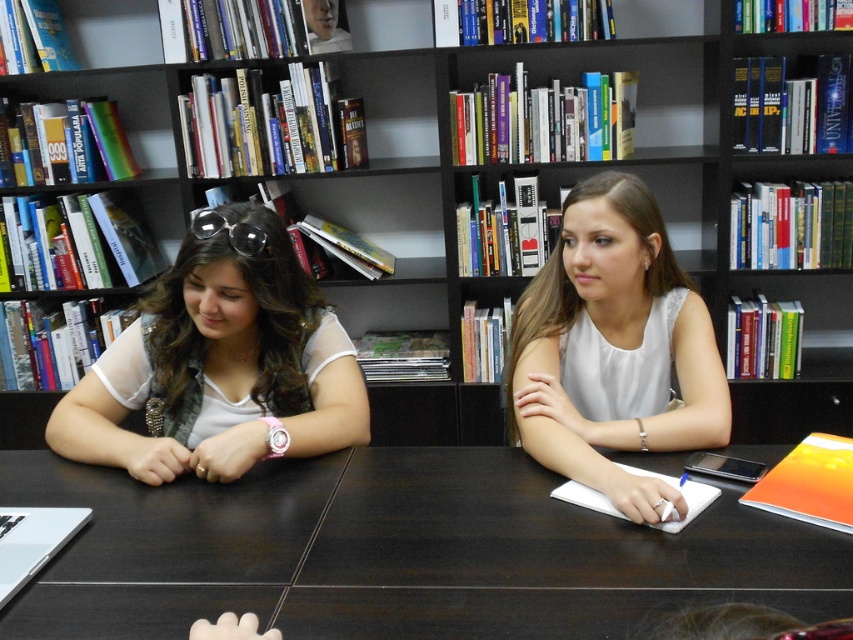
Is point (144, 342) less distant than point (679, 340)?

No, (144, 342) is behind (679, 340).

This screenshot has width=853, height=640. I want to click on matte white shirt at left, so click(221, 365).

Identify the location of matte white shirt at left. (221, 365).

Can you confirm if black matte bookcase at upper center is thinner than matte white shirt at left?

No, black matte bookcase at upper center is not thinner than matte white shirt at left.

Is black matte bookcase at upper center closer to camera compared to matte white shirt at left?

No.

Does point (482, 54) lie behind point (252, 314)?

Yes.

Identify the location of black matte bookcase at upper center. (531, 157).

Who is lower down, black matte bookcase at upper center or white satin blouse at center?

white satin blouse at center

Can you confirm if black matte bookcase at upper center is smaller than white satin blouse at center?

No, black matte bookcase at upper center is not smaller than white satin blouse at center.

Which is in front, point (438, 392) or point (596, 211)?

Point (596, 211) is in front.

Where is `black matte bookcase at upper center`? black matte bookcase at upper center is located at coordinates (531, 157).